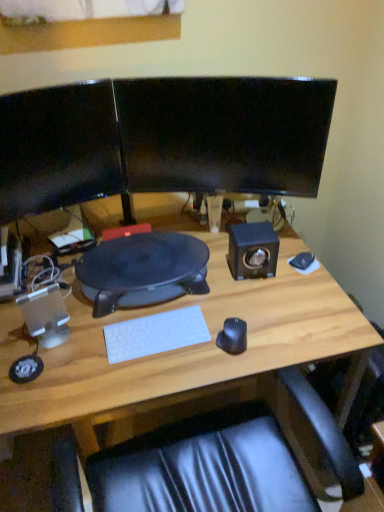
Identify the location of free point below white matte keyboard at center (from a real-world perspective). (148, 342).